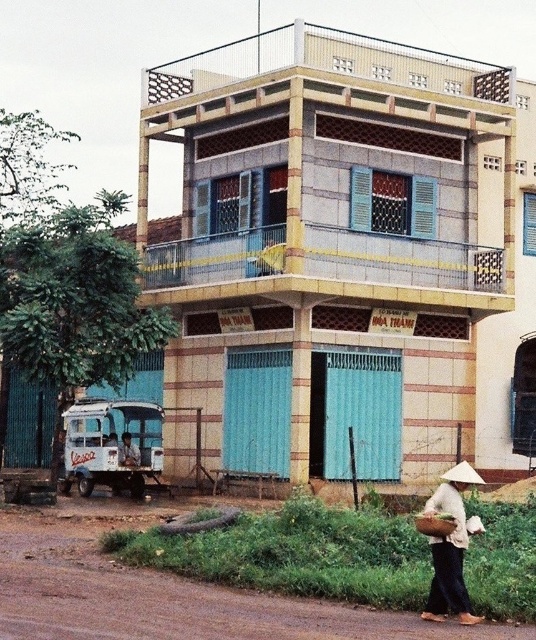
Is point (130, 579) behind point (466, 472)?

Yes, point (130, 579) is farther from viewer.

Is brown dirt track at lower left smaller than white straw hat at lower right?

Indeed, brown dirt track at lower left has a smaller size compared to white straw hat at lower right.

From the picture: Who is more distant from viewer, (86, 602) or (478, 483)?

The point (478, 483) is behind.

You are a GUI agent. You are given a task and a screenshot of the screen. Output one action in this format:
    pyautogui.click(x=<x>, y=<y>)
    Task: Click on the brown dirt track at lower left
    
    Given the screenshot: What is the action you would take?
    pyautogui.click(x=167, y=595)

Is white woven basket at lower right thinner than white straw hat at lower right?

In fact, white woven basket at lower right might be wider than white straw hat at lower right.

Does white woven basket at lower right appear on the left side of white straw hat at lower right?

Correct, you'll find white woven basket at lower right to the left of white straw hat at lower right.

Between point (461, 516) and point (472, 474), which one is positioned behind?

The point (472, 474) is behind.

The height and width of the screenshot is (640, 536). I want to click on white woven basket at lower right, so click(450, 545).

Between white woven basket at lower right and brown woven basket at lower right, which one appears on the left side from the viewer's perspective?

From the viewer's perspective, brown woven basket at lower right appears more on the left side.

Where is `white woven basket at lower right`? The height and width of the screenshot is (640, 536). white woven basket at lower right is located at coordinates (450, 545).

Does point (463, 596) come behind point (443, 518)?

No, it is in front of (443, 518).

This screenshot has width=536, height=640. I want to click on white woven basket at lower right, so click(450, 545).